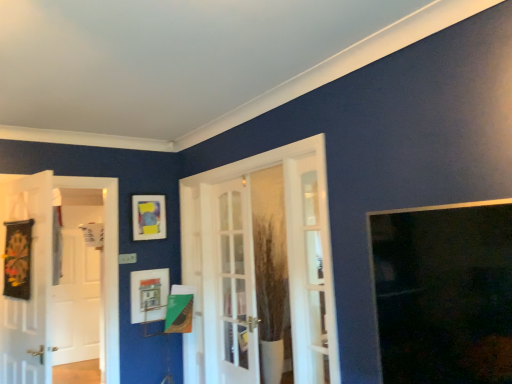
Question: Is transparent glass window at upper right far from matte plastic picture frame at upper left, the 2th picture frame in the bottom-to-top sequence?

Choices:
 (A) yes
 (B) no

Answer: (A)

Question: Considering the relative positions of transparent glass window at upper right and matte plastic picture frame at upper left, the 2th picture frame in the bottom-to-top sequence, in the image provided, is transparent glass window at upper right to the right of matte plastic picture frame at upper left, the 2th picture frame in the bottom-to-top sequence, from the viewer's perspective?

Choices:
 (A) no
 (B) yes

Answer: (B)

Question: Is transparent glass window at upper right with matte plastic picture frame at upper left, the 2th picture frame in the bottom-to-top sequence?

Choices:
 (A) yes
 (B) no

Answer: (B)

Question: From the image's perspective, is transparent glass window at upper right beneath matte plastic picture frame at upper left, the 2th picture frame in the bottom-to-top sequence?

Choices:
 (A) no
 (B) yes

Answer: (B)

Question: Is transparent glass window at upper right outside matte plastic picture frame at upper left, which is the 1th picture frame in top-to-bottom order?

Choices:
 (A) no
 (B) yes

Answer: (B)

Question: In terms of size, does transparent glass window at upper right appear bigger or smaller than white glossy screen door at left?

Choices:
 (A) small
 (B) big

Answer: (A)

Question: Considering their positions, is transparent glass window at upper right located in front of or behind white glossy screen door at left?

Choices:
 (A) front
 (B) behind

Answer: (A)

Question: From a real-world perspective, is transparent glass window at upper right positioned above or below white glossy screen door at left?

Choices:
 (A) above
 (B) below

Answer: (A)

Question: Visually, is transparent glass window at upper right positioned to the left or to the right of white glossy screen door at left?

Choices:
 (A) right
 (B) left

Answer: (A)

Question: Considering the positions of black fabric banner at left, which is counted as the first door, starting from the left, and white glass door at center, the third door in the left-to-right sequence, in the image, is black fabric banner at left, which is counted as the first door, starting from the left, wider or thinner than white glass door at center, the third door in the left-to-right sequence,?

Choices:
 (A) wide
 (B) thin

Answer: (B)

Question: In the image, is black fabric banner at left, which is the third door in right-to-left order, on the left side or the right side of white glass door at center, the third door in the left-to-right sequence?

Choices:
 (A) right
 (B) left

Answer: (B)

Question: From a real-world perspective, is black fabric banner at left, which is counted as the first door, starting from the left, positioned above or below white glass door at center, the third door in the left-to-right sequence?

Choices:
 (A) below
 (B) above

Answer: (B)

Question: From the image's perspective, is black fabric banner at left, which is counted as the first door, starting from the left, positioned above or below white glass door at center, the third door in the left-to-right sequence?

Choices:
 (A) below
 (B) above

Answer: (B)

Question: Considering the positions of point (103, 283) and point (421, 283), is point (103, 283) closer or farther from the camera than point (421, 283)?

Choices:
 (A) closer
 (B) farther

Answer: (B)

Question: Considering the positions of white glossy screen door at left and transparent glass window at upper right in the image, is white glossy screen door at left bigger or smaller than transparent glass window at upper right?

Choices:
 (A) small
 (B) big

Answer: (B)